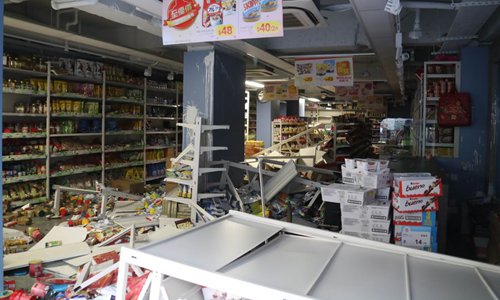
This screenshot has height=300, width=500. What are the coordinates of `ceiling` in the screenshot? It's located at (376, 24), (475, 22).